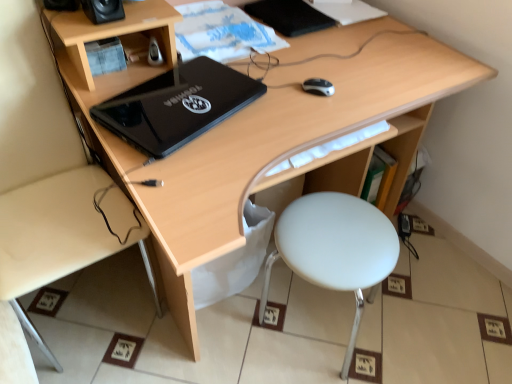
The height and width of the screenshot is (384, 512). I want to click on vacant space that is to the left of white plastic stool at lower right, so click(x=229, y=341).